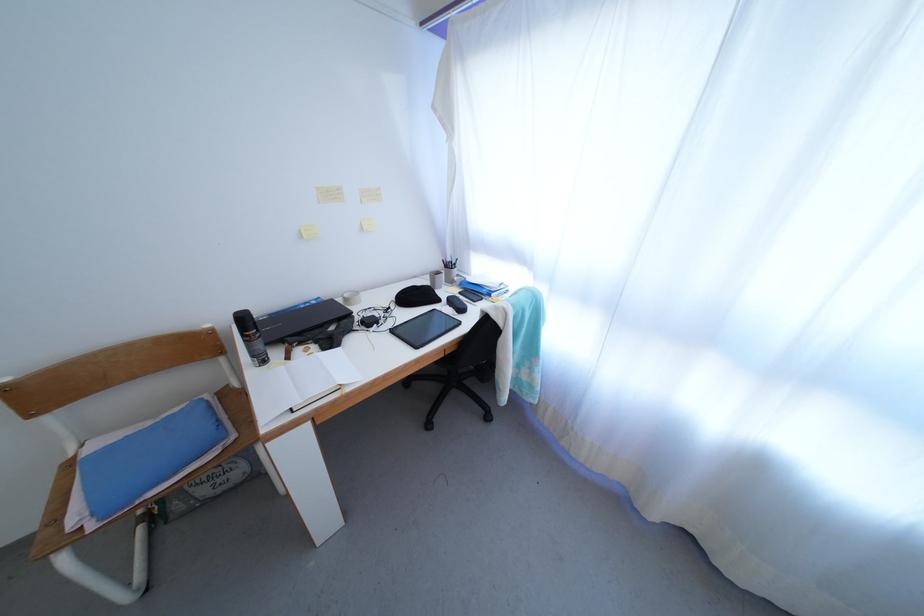
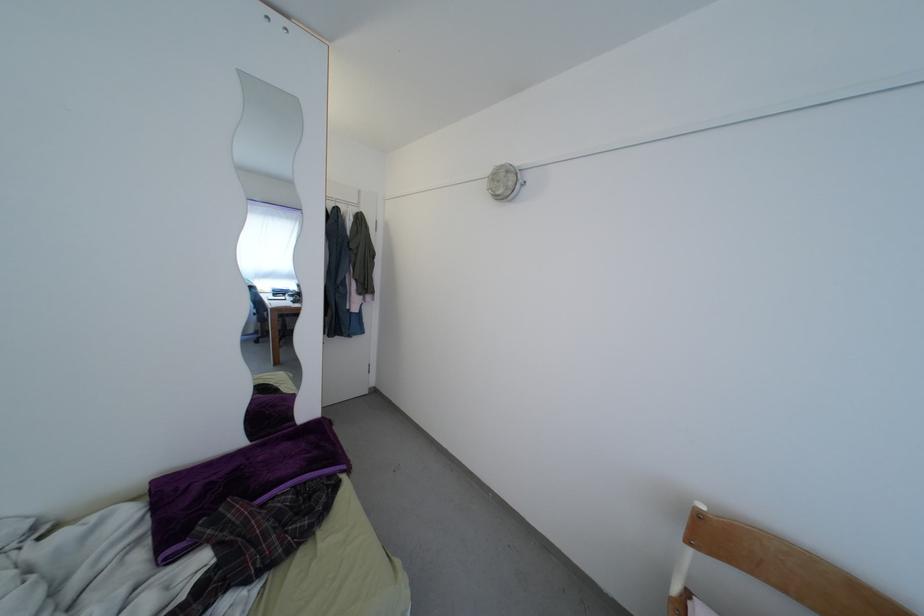
Question: The first image is from the beginning of the video and the second image is from the end. How did the camera likely rotate when shooting the video?

Choices:
 (A) Left
 (B) Right
 (C) Up
 (D) Down

Answer: (A)